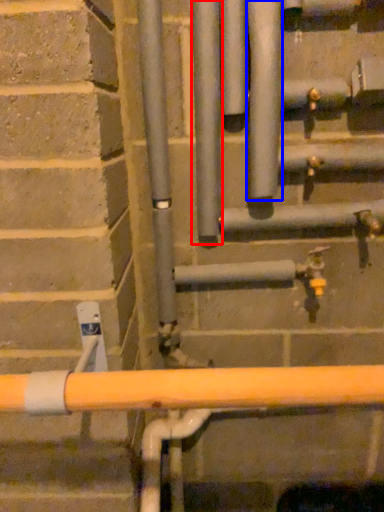
Question: Which object is further to the camera taking this photo, pipe (highlighted by a red box) or pipe (highlighted by a blue box)?

Choices:
 (A) pipe
 (B) pipe

Answer: (A)